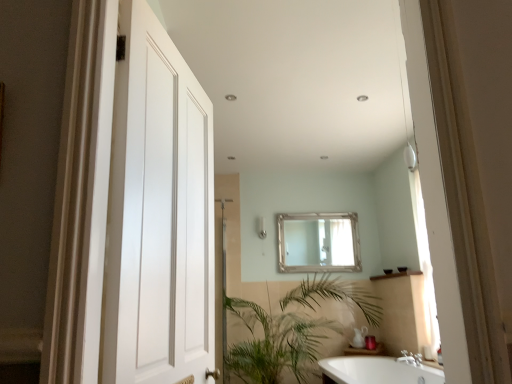
The width and height of the screenshot is (512, 384). I want to click on empty space that is ontop of silver metallic mirror at center (from a real-world perspective), so click(x=318, y=215).